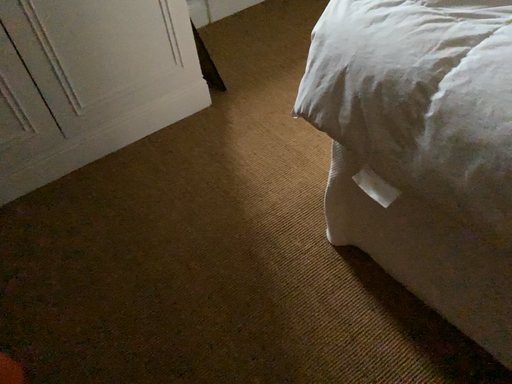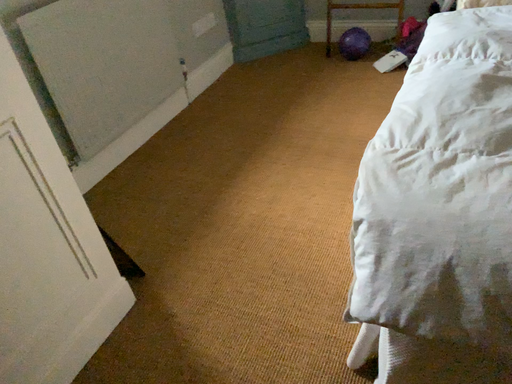
Question: Which way did the camera rotate in the video?

Choices:
 (A) rotated downward
 (B) rotated upward

Answer: (B)